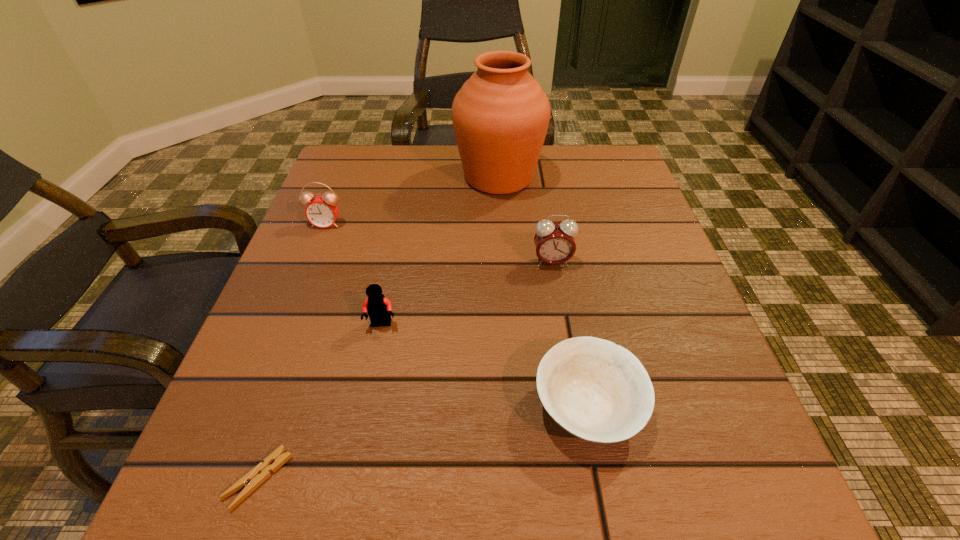
Where is `object that is the fourth nearest to the bowl`? object that is the fourth nearest to the bowl is located at coordinates (500, 115).

Image resolution: width=960 pixels, height=540 pixels. Identify the location of object that is the fourth closest one to the urn. (596, 390).

What are the coordinates of `vacant space that satisfies the following two spatial constraints: 1. on the back side of the bowl; 2. on the right side of the shortest object` in the screenshot? It's located at (283, 408).

This screenshot has width=960, height=540. Identify the location of vacant region that satisfies the following two spatial constraints: 1. on the clock face of the bowl; 2. on the right side of the left alarm clock. [x=253, y=408].

You are a GUI agent. You are given a task and a screenshot of the screen. Output one action in this format:
    pyautogui.click(x=<x>, y=<y>)
    Task: Click on the free space that satisfies the following two spatial constraints: 1. on the clock face of the farther alarm clock; 2. on the left side of the shortest object
    The image size is (960, 540).
    Given the screenshot: What is the action you would take?
    pyautogui.click(x=226, y=478)

Locate an element on the screen. Image resolution: width=960 pixels, height=540 pixels. blank space that satisfies the following two spatial constraints: 1. on the front-facing side of the fourth object from right to left; 2. on the right side of the bowl is located at coordinates (365, 408).

Image resolution: width=960 pixels, height=540 pixels. I want to click on vacant area that satisfies the following two spatial constraints: 1. on the clock face of the left alarm clock; 2. on the left side of the shortest object, so click(x=226, y=478).

You are a GUI agent. You are given a task and a screenshot of the screen. Output one action in this format:
    pyautogui.click(x=<x>, y=<y>)
    Task: Click on the vacant space that satisfies the following two spatial constraints: 1. on the front-facing side of the third object from left to right; 2. on the right side of the second shortest object
    The height and width of the screenshot is (540, 960).
    Given the screenshot: What is the action you would take?
    pyautogui.click(x=365, y=408)

Where is `vacant region that satisfies the following two spatial constraints: 1. on the clock face of the bowl; 2. on the right side of the left alarm clock`? This screenshot has width=960, height=540. vacant region that satisfies the following two spatial constraints: 1. on the clock face of the bowl; 2. on the right side of the left alarm clock is located at coordinates (253, 408).